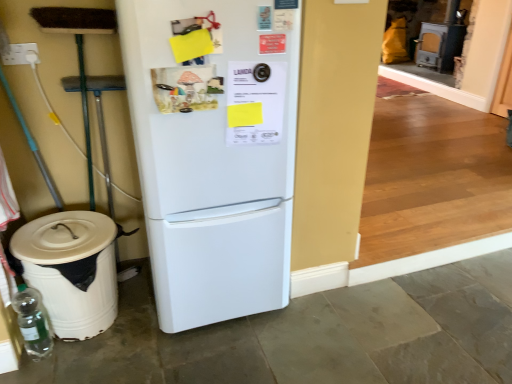
Question: Considering the relative positions of white matte refrigerator at center and white plastic trash bin at lower left in the image provided, is white matte refrigerator at center to the left of white plastic trash bin at lower left from the viewer's perspective?

Choices:
 (A) no
 (B) yes

Answer: (A)

Question: Could you tell me if white matte refrigerator at center is facing white plastic trash bin at lower left?

Choices:
 (A) no
 (B) yes

Answer: (A)

Question: Can you confirm if white matte refrigerator at center is thinner than white plastic trash bin at lower left?

Choices:
 (A) yes
 (B) no

Answer: (B)

Question: From a real-world perspective, does white matte refrigerator at center stand above white plastic trash bin at lower left?

Choices:
 (A) no
 (B) yes

Answer: (B)

Question: Is white matte refrigerator at center to the right of white plastic trash bin at lower left from the viewer's perspective?

Choices:
 (A) yes
 (B) no

Answer: (A)

Question: Is white plastic trash bin at lower left inside or outside of white matte refrigerator at center?

Choices:
 (A) inside
 (B) outside

Answer: (B)

Question: Would you say white plastic trash bin at lower left is to the left or to the right of white matte refrigerator at center in the picture?

Choices:
 (A) left
 (B) right

Answer: (A)

Question: Considering the positions of white plastic trash bin at lower left and white matte refrigerator at center in the image, is white plastic trash bin at lower left wider or thinner than white matte refrigerator at center?

Choices:
 (A) wide
 (B) thin

Answer: (B)

Question: Considering their positions, is white plastic trash bin at lower left located in front of or behind white matte refrigerator at center?

Choices:
 (A) behind
 (B) front

Answer: (A)

Question: From their relative heights in the image, would you say white plastic trash bin at lower left is taller or shorter than transparent glass bottle at lower left?

Choices:
 (A) short
 (B) tall

Answer: (B)

Question: From the image's perspective, is white plastic trash bin at lower left located above or below transparent glass bottle at lower left?

Choices:
 (A) below
 (B) above

Answer: (B)

Question: Is point (51, 258) closer or farther from the camera than point (44, 354)?

Choices:
 (A) closer
 (B) farther

Answer: (A)

Question: From a real-world perspective, is white plastic trash bin at lower left above or below transparent glass bottle at lower left?

Choices:
 (A) below
 (B) above

Answer: (B)

Question: Considering the positions of white matte refrigerator at center and transparent glass bottle at lower left in the image, is white matte refrigerator at center wider or thinner than transparent glass bottle at lower left?

Choices:
 (A) wide
 (B) thin

Answer: (A)

Question: Looking at the image, does white matte refrigerator at center seem bigger or smaller compared to transparent glass bottle at lower left?

Choices:
 (A) big
 (B) small

Answer: (A)